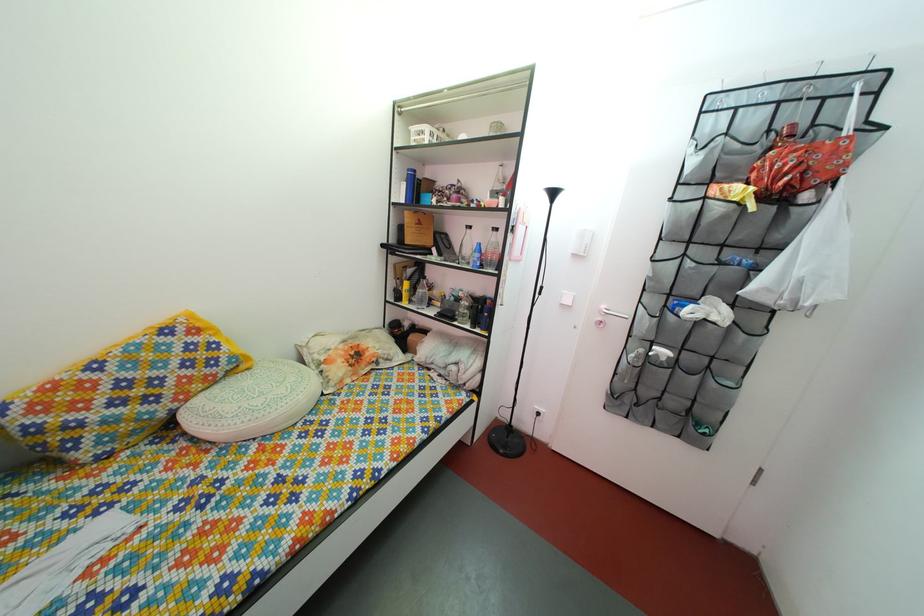
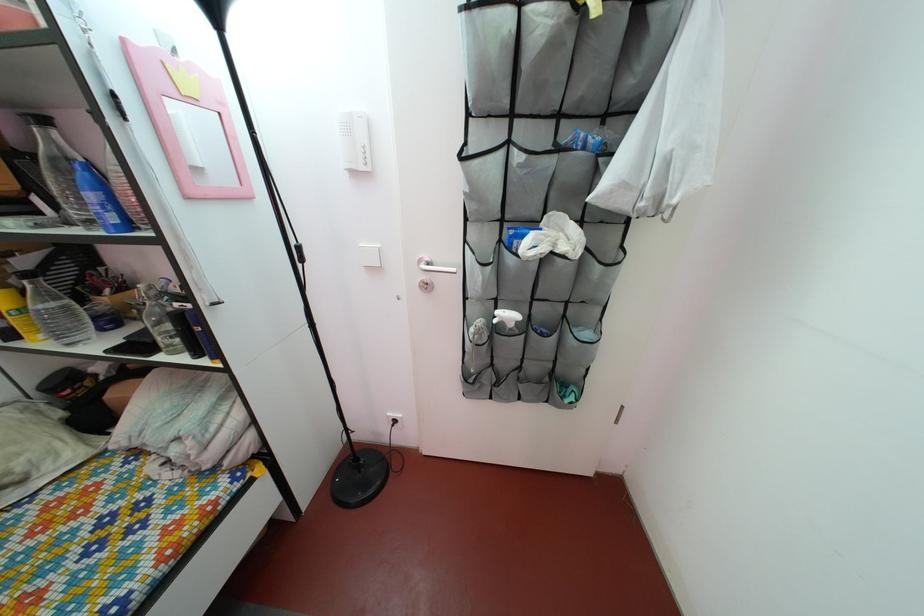
Locate, in the second image, the point that corresponds to point (414, 302) in the first image.

(27, 330)